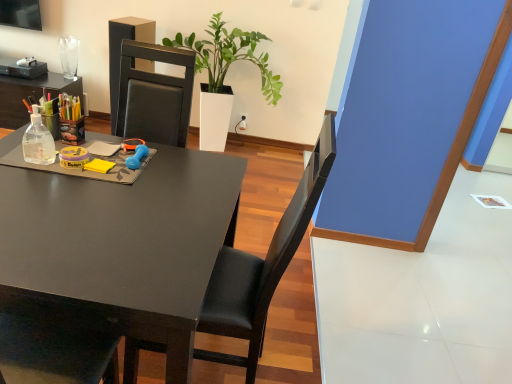
Where is `black leather chair at center`? Image resolution: width=512 pixels, height=384 pixels. black leather chair at center is located at coordinates (262, 267).

Measure the distance between point (x=193, y=48) and camera.

A distance of 1.98 meters exists between point (x=193, y=48) and camera.

Measure the distance between point [65,313] and camera.

Point [65,313] is 99.00 centimeters away from camera.

Where is `black leather chair at center`? The image size is (512, 384). black leather chair at center is located at coordinates (262, 267).

From the image's perspective, is white glossy planter at center above matte black desk at center?

Yes, from the image's perspective, white glossy planter at center is above matte black desk at center.

Is white glossy planter at center in front of matte black desk at center?

That is False.

Considering the relative sizes of white glossy planter at center and matte black desk at center in the image provided, is white glossy planter at center thinner than matte black desk at center?

Yes.

How many degrees apart are the facing directions of white glossy planter at center and matte black desk at center?

There is a 89-degree angle between the facing directions of white glossy planter at center and matte black desk at center.

Is white glossy planter at center turned away from black leather chair at center?

That's not correct — white glossy planter at center is not looking away from black leather chair at center.

Looking at this image, between white glossy planter at center and black leather chair at center, which one appears on the left side from the viewer's perspective?

white glossy planter at center.

From the image's perspective, is white glossy planter at center located beneath black leather chair at center?

No, from the image's perspective, white glossy planter at center is not beneath black leather chair at center.

The image size is (512, 384). In order to click on houseplant behind the black leather chair at center in this screenshot , I will do `click(229, 56)`.

In the image, is black leather chair at center positioned in front of or behind white glossy planter at center?

black leather chair at center is in front of white glossy planter at center.

Looking at the image, does black leather chair at center seem bigger or smaller compared to white glossy planter at center?

Considering their sizes, black leather chair at center takes up less space than white glossy planter at center.

From the image's perspective, is black leather chair at center positioned above or below white glossy planter at center?

Based on their image positions, black leather chair at center is located beneath white glossy planter at center.

Based on their positions, is matte black desk at center located to the left or right of black leather chair at center?

Clearly, matte black desk at center is on the left of black leather chair at center in the image.

From the image's perspective, is matte black desk at center above or below black leather chair at center?

Based on their image positions, matte black desk at center is located beneath black leather chair at center.

Find the location of a particular element. This screenshot has width=512, height=384. chair lying above the matte black desk at center (from the image's perspective) is located at coordinates (262, 267).

From the image's perspective, which object appears higher, black leather chair at center or matte black desk at center?

black leather chair at center appears higher in the image.

Between black leather chair at center and matte black desk at center, which one has larger size?

matte black desk at center is bigger.

Is point (319, 169) positioned after point (34, 223)?

That is False.

Consider the image. Can you confirm if black leather chair at center is thinner than matte black desk at center?

Yes, black leather chair at center is thinner than matte black desk at center.

Between matte black desk at center and white glossy planter at center, which one is positioned in front?

matte black desk at center is closer to the camera.

Consider the image. Is matte black desk at center turned away from white glossy planter at center?

matte black desk at center does not have its back to white glossy planter at center.

Is matte black desk at center far away from white glossy planter at center?

Indeed, matte black desk at center is not near white glossy planter at center.

Locate an element on the screen. The height and width of the screenshot is (384, 512). desk in front of the white glossy planter at center is located at coordinates (120, 247).

The height and width of the screenshot is (384, 512). Find the location of `chair below the white glossy planter at center (from the image's perspective)`. chair below the white glossy planter at center (from the image's perspective) is located at coordinates (262, 267).

When comparing their distances from black leather chair at center, does white glossy planter at center or matte black desk at center seem further?

white glossy planter at center lies further to black leather chair at center than the other object.

Estimate the real-world distances between objects in this image. Which object is closer to white glossy planter at center, matte black desk at center or black leather chair at center?

The object closer to white glossy planter at center is matte black desk at center.

Which object lies further to the anchor point matte black desk at center, white glossy planter at center or black leather chair at center?

white glossy planter at center is positioned further to the anchor matte black desk at center.

Looking at the image, which one is located closer to black leather chair at center, matte black desk at center or white glossy planter at center?

Among the two, matte black desk at center is located nearer to black leather chair at center.

Considering their positions, is black leather chair at center positioned further to white glossy planter at center than matte black desk at center?

black leather chair at center lies further to white glossy planter at center than the other object.

Estimate the real-world distances between objects in this image. Which object is further from matte black desk at center, black leather chair at center or white glossy planter at center?

white glossy planter at center.

Locate an element on the screen. Image resolution: width=512 pixels, height=384 pixels. chair located between matte black desk at center and white glossy planter at center in the depth direction is located at coordinates (262, 267).